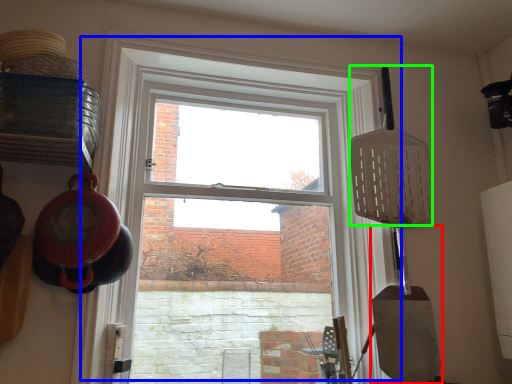
Question: Which object is positioned closest to shovel (highlighted by a red box)? Select from window (highlighted by a blue box) and spatula (highlighted by a green box).

Choices:
 (A) window
 (B) spatula

Answer: (B)